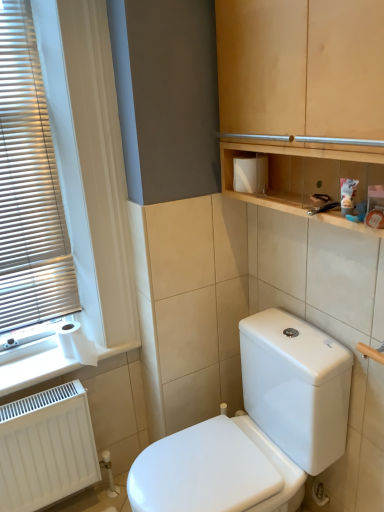
Find the location of a particular element. This screenshot has height=512, width=384. free space to the left of white matte toilet paper at lower left is located at coordinates (31, 371).